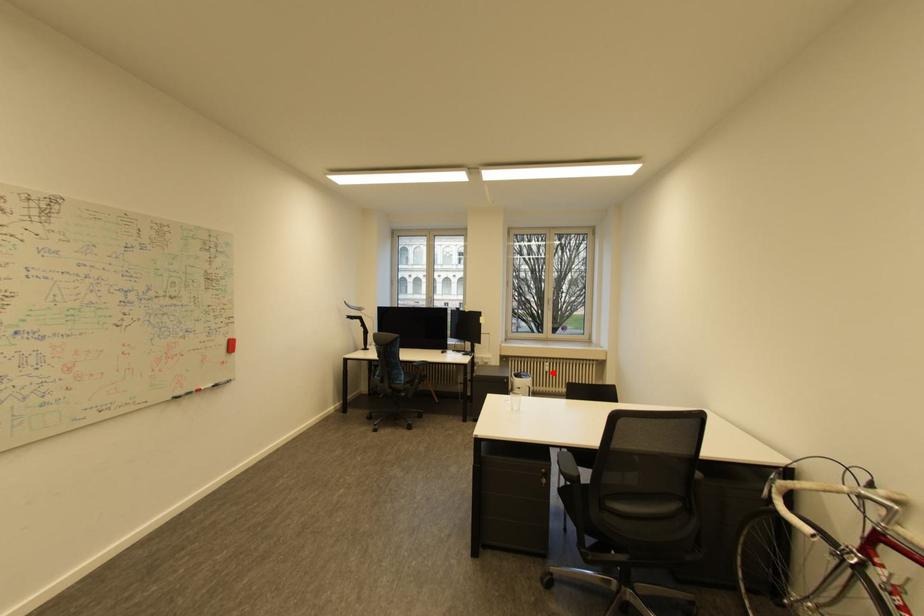
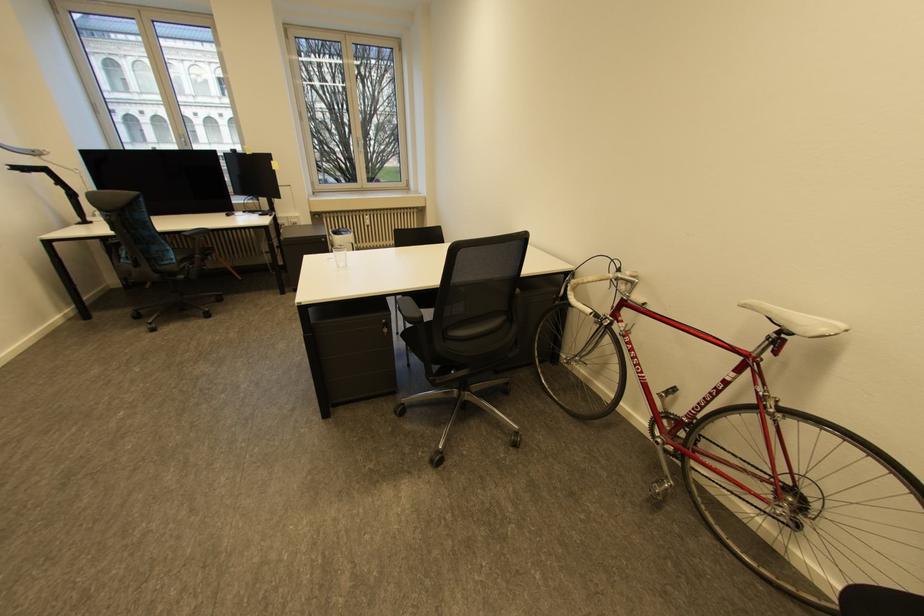
Question: I am providing you with two images of the same scene from different viewpoints. Image1 has a red point marked. In image2, the corresponding 3D location appears at what relative position? Reply with the corresponding letter.

Choices:
 (A) Closer
 (B) Farther

Answer: (B)